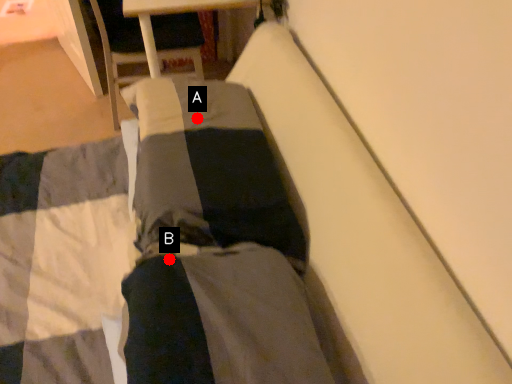
Question: Two points are circled on the image, labeled by A and B beside each circle. Which point is farther from the camera taking this photo?

Choices:
 (A) A is further
 (B) B is further

Answer: (A)